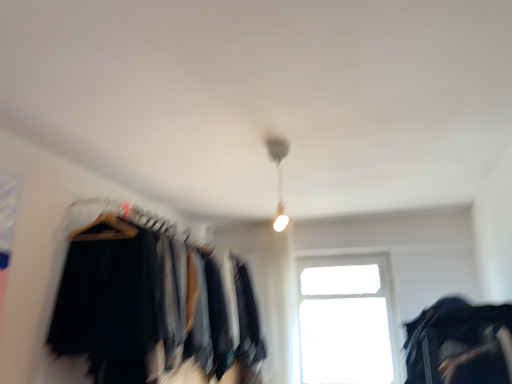
Question: Does black fabric bag at lower right appear on the right side of white glossy lamp at upper center?

Choices:
 (A) no
 (B) yes

Answer: (B)

Question: Does black fabric bag at lower right turn towards white glossy lamp at upper center?

Choices:
 (A) yes
 (B) no

Answer: (B)

Question: Can white glossy lamp at upper center be found inside black fabric bag at lower right?

Choices:
 (A) yes
 (B) no

Answer: (B)

Question: Does black fabric bag at lower right have a lesser height compared to white glossy lamp at upper center?

Choices:
 (A) yes
 (B) no

Answer: (A)

Question: Can you confirm if black fabric bag at lower right is bigger than white glossy lamp at upper center?

Choices:
 (A) yes
 (B) no

Answer: (A)

Question: From a real-world perspective, is transparent glass window at center above or below black fabric clothes at left?

Choices:
 (A) above
 (B) below

Answer: (B)

Question: In terms of height, does transparent glass window at center look taller or shorter compared to black fabric clothes at left?

Choices:
 (A) tall
 (B) short

Answer: (A)

Question: Does point (368, 258) appear closer or farther from the camera than point (142, 324)?

Choices:
 (A) farther
 (B) closer

Answer: (A)

Question: From the image's perspective, is transparent glass window at center located above or below black fabric clothes at left?

Choices:
 (A) below
 (B) above

Answer: (A)

Question: In terms of height, does black fabric clothes at left look taller or shorter compared to black fabric bag at lower right?

Choices:
 (A) tall
 (B) short

Answer: (A)

Question: Is black fabric clothes at left to the left or to the right of black fabric bag at lower right in the image?

Choices:
 (A) right
 (B) left

Answer: (B)

Question: Is black fabric clothes at left wider or thinner than black fabric bag at lower right?

Choices:
 (A) wide
 (B) thin

Answer: (A)

Question: From a real-world perspective, is black fabric clothes at left physically located above or below black fabric bag at lower right?

Choices:
 (A) below
 (B) above

Answer: (B)

Question: In terms of width, does transparent glass window at center look wider or thinner when compared to black fabric bag at lower right?

Choices:
 (A) wide
 (B) thin

Answer: (B)

Question: From a real-world perspective, is transparent glass window at center positioned above or below black fabric bag at lower right?

Choices:
 (A) above
 (B) below

Answer: (A)